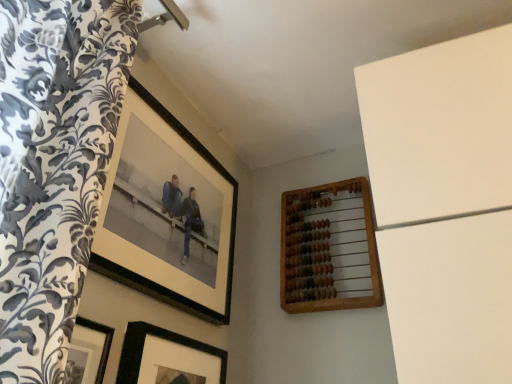
The width and height of the screenshot is (512, 384). What do you see at coordinates (166, 213) in the screenshot? I see `black matte picture frame at upper left, marked as the third picture frame in a right-to-left arrangement` at bounding box center [166, 213].

Where is `wooden abacus at upper right, which is counted as the 1th picture frame, starting from the right`? The width and height of the screenshot is (512, 384). wooden abacus at upper right, which is counted as the 1th picture frame, starting from the right is located at coordinates (329, 249).

Which is more to the right, black matte picture frame at upper left, which is the first picture frame in left-to-right order, or wooden abacus at upper right, which is counted as the 1th picture frame, starting from the right?

Positioned to the right is wooden abacus at upper right, which is counted as the 1th picture frame, starting from the right.

Is black matte picture frame at upper left, marked as the third picture frame in a right-to-left arrangement, wider than wooden abacus at upper right, arranged as the 3th picture frame when viewed from the left?

In fact, black matte picture frame at upper left, marked as the third picture frame in a right-to-left arrangement, might be narrower than wooden abacus at upper right, arranged as the 3th picture frame when viewed from the left.

From the image's perspective, which one is positioned lower, black matte picture frame at upper left, which is the first picture frame in left-to-right order, or wooden abacus at upper right, which is counted as the 1th picture frame, starting from the right?

From the image's view, wooden abacus at upper right, which is counted as the 1th picture frame, starting from the right, is below.

Where is `the 2nd picture frame counting from the right of the black matte picture frame at upper left, marked as the third picture frame in a right-to-left arrangement`? The image size is (512, 384). the 2nd picture frame counting from the right of the black matte picture frame at upper left, marked as the third picture frame in a right-to-left arrangement is located at coordinates (329, 249).

From the image's perspective, does black matte picture frame at upper left, marked as the third picture frame in a right-to-left arrangement, appear lower than black matte picture frame at lower center, acting as the second picture frame starting from the left?

Incorrect, from the image's perspective, black matte picture frame at upper left, marked as the third picture frame in a right-to-left arrangement, is higher than black matte picture frame at lower center, acting as the second picture frame starting from the left.

Can you see black matte picture frame at upper left, marked as the third picture frame in a right-to-left arrangement, touching black matte picture frame at lower center, acting as the second picture frame starting from the left?

No, black matte picture frame at upper left, marked as the third picture frame in a right-to-left arrangement, is not beside black matte picture frame at lower center, acting as the second picture frame starting from the left.

Considering the sizes of black matte picture frame at upper left, marked as the third picture frame in a right-to-left arrangement, and black matte picture frame at lower center, which is counted as the second picture frame, starting from the right, in the image, is black matte picture frame at upper left, marked as the third picture frame in a right-to-left arrangement, wider or thinner than black matte picture frame at lower center, which is counted as the second picture frame, starting from the right,?

Clearly, black matte picture frame at upper left, marked as the third picture frame in a right-to-left arrangement, has less width compared to black matte picture frame at lower center, which is counted as the second picture frame, starting from the right.

From a real-world perspective, which object stands above the other?

black matte picture frame at upper left, which is the first picture frame in left-to-right order.

Can you confirm if black matte picture frame at lower center, which is counted as the second picture frame, starting from the right, is positioned to the right of wooden abacus at upper right, which is counted as the 1th picture frame, starting from the right?

In fact, black matte picture frame at lower center, which is counted as the second picture frame, starting from the right, is to the left of wooden abacus at upper right, which is counted as the 1th picture frame, starting from the right.

Is point (183, 381) farther from camera compared to point (378, 265)?

Yes.

Does black matte picture frame at lower center, acting as the second picture frame starting from the left, turn towards wooden abacus at upper right, which is counted as the 1th picture frame, starting from the right?

No, black matte picture frame at lower center, acting as the second picture frame starting from the left, is not oriented towards wooden abacus at upper right, which is counted as the 1th picture frame, starting from the right.

From the image's perspective, between wooden abacus at upper right, arranged as the 3th picture frame when viewed from the left, and black matte picture frame at upper left, which is the first picture frame in left-to-right order, which one is located above?

black matte picture frame at upper left, which is the first picture frame in left-to-right order, is shown above in the image.

Considering the sizes of objects wooden abacus at upper right, which is counted as the 1th picture frame, starting from the right, and black matte picture frame at upper left, which is the first picture frame in left-to-right order, in the image provided, who is smaller, wooden abacus at upper right, which is counted as the 1th picture frame, starting from the right, or black matte picture frame at upper left, which is the first picture frame in left-to-right order,?

wooden abacus at upper right, which is counted as the 1th picture frame, starting from the right, is smaller.

Does wooden abacus at upper right, which is counted as the 1th picture frame, starting from the right, have a greater width compared to black matte picture frame at upper left, which is the first picture frame in left-to-right order?

Indeed, wooden abacus at upper right, which is counted as the 1th picture frame, starting from the right, has a greater width compared to black matte picture frame at upper left, which is the first picture frame in left-to-right order.

Does wooden abacus at upper right, which is counted as the 1th picture frame, starting from the right, turn towards black matte picture frame at upper left, which is the first picture frame in left-to-right order?

Yes.

Does wooden abacus at upper right, arranged as the 3th picture frame when viewed from the left, have a lesser width compared to black matte picture frame at lower center, acting as the second picture frame starting from the left?

No.

How much distance is there between wooden abacus at upper right, which is counted as the 1th picture frame, starting from the right, and black matte picture frame at lower center, which is counted as the second picture frame, starting from the right?

wooden abacus at upper right, which is counted as the 1th picture frame, starting from the right, and black matte picture frame at lower center, which is counted as the second picture frame, starting from the right, are 17.09 inches apart from each other.

Is wooden abacus at upper right, which is counted as the 1th picture frame, starting from the right, at the left side of black matte picture frame at lower center, which is counted as the second picture frame, starting from the right?

No, wooden abacus at upper right, which is counted as the 1th picture frame, starting from the right, is not to the left of black matte picture frame at lower center, which is counted as the second picture frame, starting from the right.

From a real-world perspective, between wooden abacus at upper right, which is counted as the 1th picture frame, starting from the right, and black matte picture frame at lower center, which is counted as the second picture frame, starting from the right, who is vertically higher?

In real-world perspective, wooden abacus at upper right, which is counted as the 1th picture frame, starting from the right, is above.

How different are the orientations of black matte picture frame at lower center, acting as the second picture frame starting from the left, and black matte picture frame at upper left, which is the first picture frame in left-to-right order, in degrees?

The angle between the facing direction of black matte picture frame at lower center, acting as the second picture frame starting from the left, and the facing direction of black matte picture frame at upper left, which is the first picture frame in left-to-right order, is 0.00865 degrees.

Does black matte picture frame at lower center, acting as the second picture frame starting from the left, contain black matte picture frame at upper left, marked as the third picture frame in a right-to-left arrangement?

No, black matte picture frame at upper left, marked as the third picture frame in a right-to-left arrangement, is not surrounded by black matte picture frame at lower center, acting as the second picture frame starting from the left.

Is black matte picture frame at lower center, acting as the second picture frame starting from the left, smaller than black matte picture frame at upper left, marked as the third picture frame in a right-to-left arrangement?

Indeed, black matte picture frame at lower center, acting as the second picture frame starting from the left, has a smaller size compared to black matte picture frame at upper left, marked as the third picture frame in a right-to-left arrangement.

From a real-world perspective, which picture frame is the 1st one underneath the wooden abacus at upper right, arranged as the 3th picture frame when viewed from the left? Please provide its 2D coordinates.

[(166, 213)]

Where is `picture frame in front of the black matte picture frame at upper left, marked as the third picture frame in a right-to-left arrangement`? This screenshot has height=384, width=512. picture frame in front of the black matte picture frame at upper left, marked as the third picture frame in a right-to-left arrangement is located at coordinates (168, 358).

Estimate the real-world distances between objects in this image. Which object is closer to black matte picture frame at upper left, which is the first picture frame in left-to-right order, black matte picture frame at lower center, which is counted as the second picture frame, starting from the right, or wooden abacus at upper right, arranged as the 3th picture frame when viewed from the left?

black matte picture frame at lower center, which is counted as the second picture frame, starting from the right, is positioned closer to the anchor black matte picture frame at upper left, which is the first picture frame in left-to-right order.

When comparing their distances from wooden abacus at upper right, which is counted as the 1th picture frame, starting from the right, does black matte picture frame at upper left, which is the first picture frame in left-to-right order, or black matte picture frame at lower center, which is counted as the second picture frame, starting from the right, seem closer?

black matte picture frame at upper left, which is the first picture frame in left-to-right order.

Estimate the real-world distances between objects in this image. Which object is closer to wooden abacus at upper right, arranged as the 3th picture frame when viewed from the left, black matte picture frame at lower center, acting as the second picture frame starting from the left, or black matte picture frame at upper left, which is the first picture frame in left-to-right order?

The object closer to wooden abacus at upper right, arranged as the 3th picture frame when viewed from the left, is black matte picture frame at upper left, which is the first picture frame in left-to-right order.

When comparing their distances from black matte picture frame at upper left, which is the first picture frame in left-to-right order, does wooden abacus at upper right, which is counted as the 1th picture frame, starting from the right, or black matte picture frame at lower center, which is counted as the second picture frame, starting from the right, seem closer?

black matte picture frame at lower center, which is counted as the second picture frame, starting from the right, is positioned closer to the anchor black matte picture frame at upper left, which is the first picture frame in left-to-right order.

Looking at this image, looking at the image, which one is located further to black matte picture frame at lower center, which is counted as the second picture frame, starting from the right, wooden abacus at upper right, which is counted as the 1th picture frame, starting from the right, or black matte picture frame at upper left, marked as the third picture frame in a right-to-left arrangement?

Based on the image, wooden abacus at upper right, which is counted as the 1th picture frame, starting from the right, appears to be further to black matte picture frame at lower center, which is counted as the second picture frame, starting from the right.

In the scene shown: When comparing their distances from black matte picture frame at lower center, acting as the second picture frame starting from the left, does black matte picture frame at upper left, which is the first picture frame in left-to-right order, or wooden abacus at upper right, which is counted as the 1th picture frame, starting from the right, seem further?

wooden abacus at upper right, which is counted as the 1th picture frame, starting from the right.

Identify the location of picture frame located between black matte picture frame at lower center, which is counted as the second picture frame, starting from the right, and wooden abacus at upper right, which is counted as the 1th picture frame, starting from the right, in the depth direction. This screenshot has width=512, height=384. (166, 213).